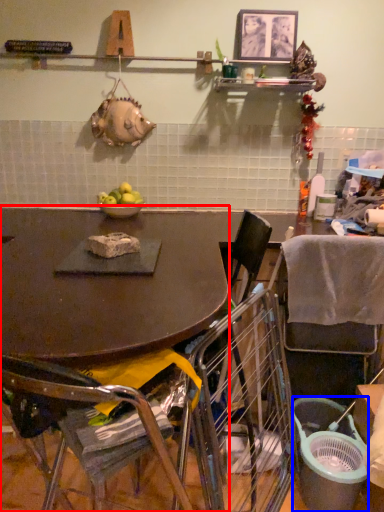
Question: Which of the following is the farthest to the observer, desk (highlighted by a red box) or trash bin/can (highlighted by a blue box)?

Choices:
 (A) desk
 (B) trash bin/can

Answer: (B)